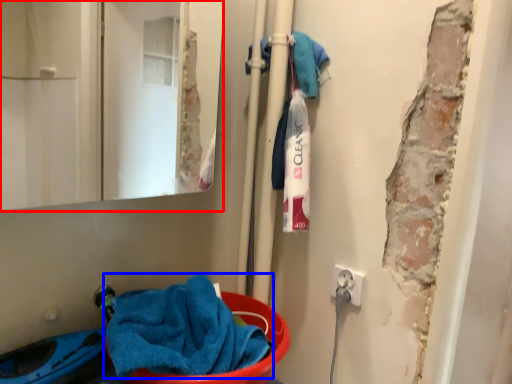
Question: Which object is closer to the camera taking this photo, mirror (highlighted by a red box) or towel (highlighted by a blue box)?

Choices:
 (A) mirror
 (B) towel

Answer: (A)